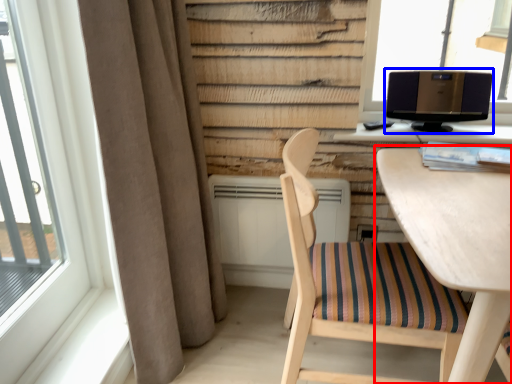
Question: Which of the following is the farthest to the observer, table (highlighted by a red box) or computer monitor (highlighted by a blue box)?

Choices:
 (A) table
 (B) computer monitor

Answer: (B)